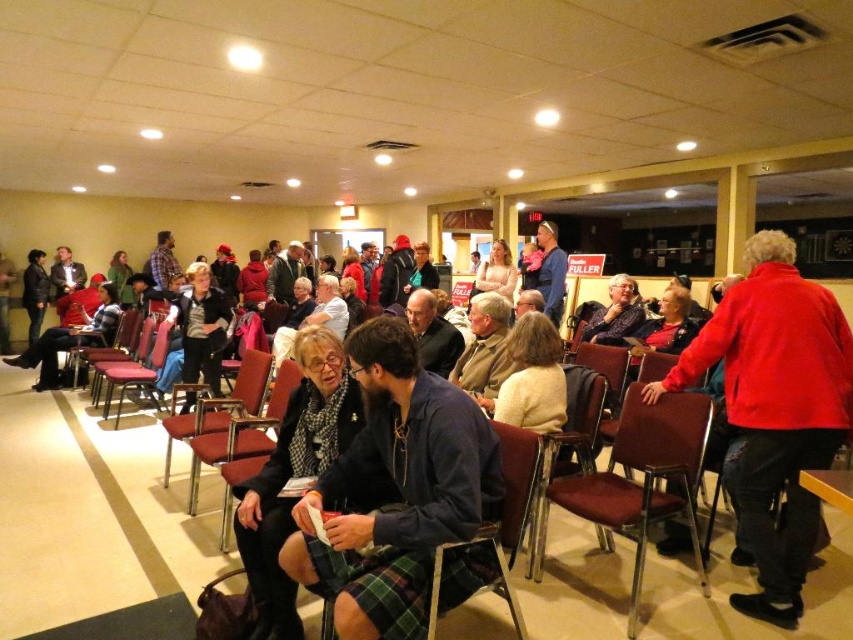
Consider the image. Does dark blue fabric shirt at center have a lesser height compared to metallic silver chair at center?

A: No.

Between dark blue fabric shirt at center and metallic silver chair at center, which one appears on the left side from the viewer's perspective?

Positioned to the left is metallic silver chair at center.

Who is more distant from viewer, (355, 360) or (210, 388)?

Point (210, 388)

Locate an element on the screen. dark blue fabric shirt at center is located at coordinates (395, 490).

Can you confirm if dark blue fabric shirt at center is taller than plaid skirt at center?

No.

Can you confirm if dark blue fabric shirt at center is positioned below plaid skirt at center?

Incorrect, dark blue fabric shirt at center is not positioned below plaid skirt at center.

Which is behind, point (454, 413) or point (341, 428)?

Positioned behind is point (341, 428).

Locate an element on the screen. dark blue fabric shirt at center is located at coordinates (395, 490).

Does red fleece jacket at right have a greater height compared to metallic red chair at left?

Yes.

Is red fleece jacket at right to the left of metallic red chair at left from the viewer's perspective?

In fact, red fleece jacket at right is to the right of metallic red chair at left.

Where is `red fleece jacket at right`? This screenshot has width=853, height=640. red fleece jacket at right is located at coordinates (775, 410).